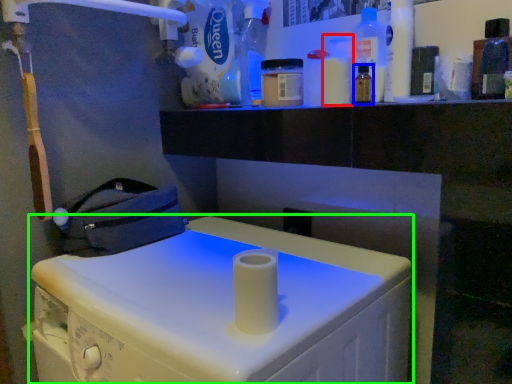
Question: Which is nearer to the bottle (highlighted by a red box)? bottle (highlighted by a blue box) or machine (highlighted by a green box).

Choices:
 (A) bottle
 (B) machine

Answer: (A)